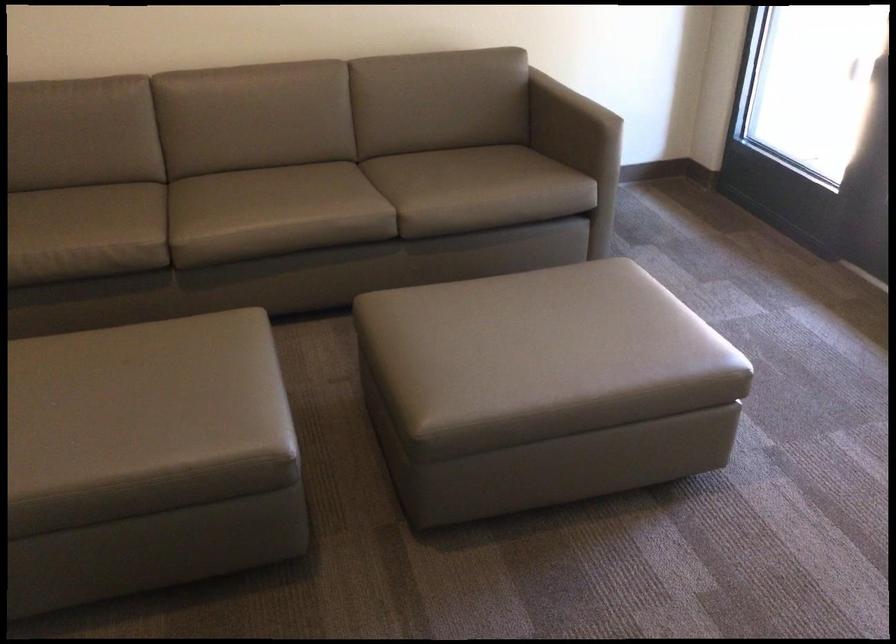
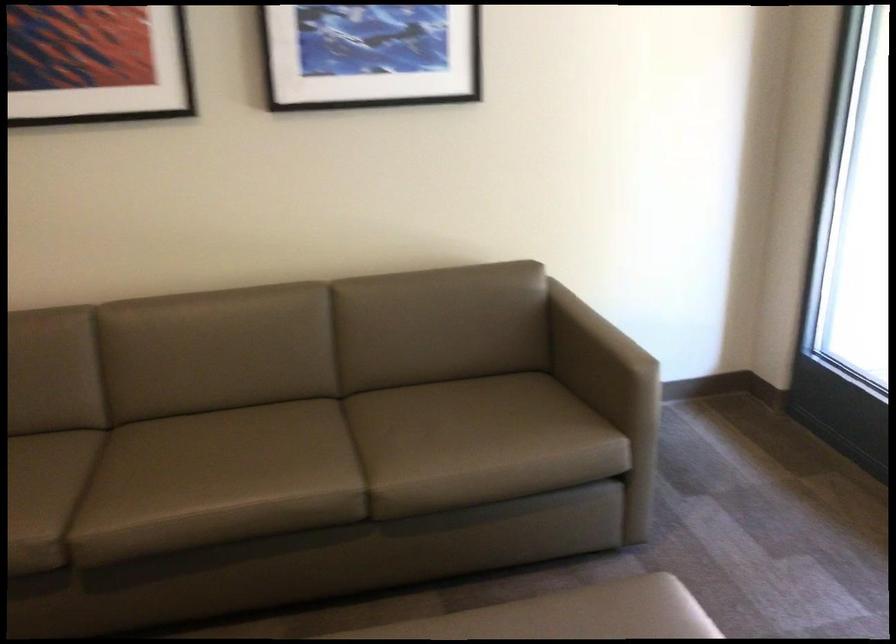
Question: I am providing you with two images of the same scene from different viewpoints. Which of the following objects are not visible in image2?

Choices:
 (A) brown sofa sitting surface
 (B) brown sofa armrest
 (C) ottoman sitting surface
 (D) none of these

Answer: (D)